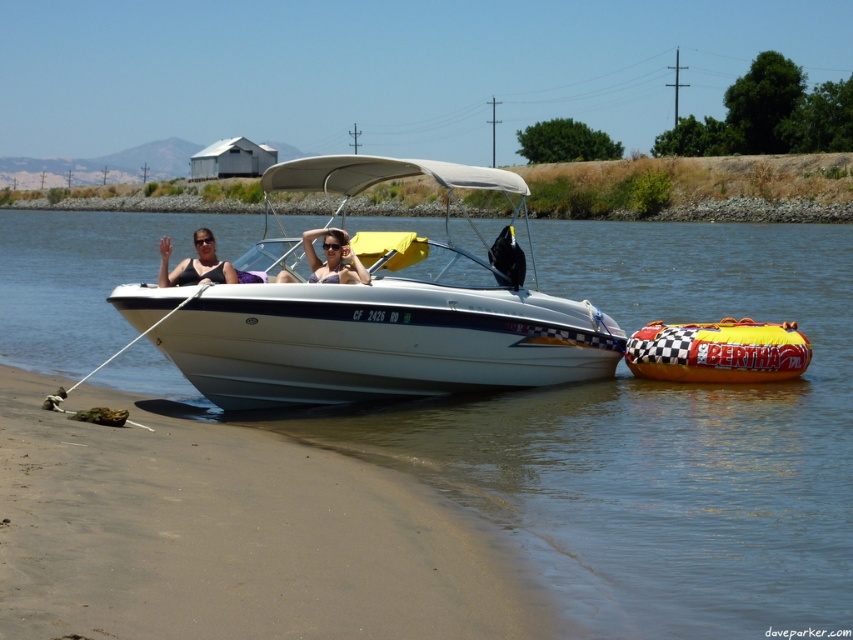
Question: Is white glossy boat at center to the right of yellow checkered tube at lower right from the viewer's perspective?

Choices:
 (A) yes
 (B) no

Answer: (B)

Question: Which of the following is the closest to the observer?

Choices:
 (A) (566, 512)
 (B) (163, 337)
 (C) (755, 344)

Answer: (A)

Question: Which point is farther to the camera?

Choices:
 (A) (312, 374)
 (B) (281, 436)

Answer: (A)

Question: Can you confirm if white glossy water at center is positioned above yellow checkered tube at lower right?

Choices:
 (A) yes
 (B) no

Answer: (A)

Question: Among these points, which one is farthest from the camera?

Choices:
 (A) (323, 420)
 (B) (177, 417)
 (C) (517, 192)

Answer: (C)

Question: Is white glossy water at center to the right of white glossy boat at center from the viewer's perspective?

Choices:
 (A) yes
 (B) no

Answer: (A)